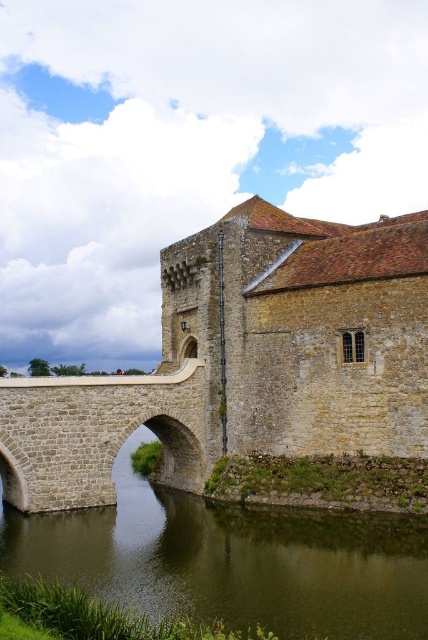
Question: Can you confirm if green stone water at center is smaller than stone bridge at center?

Choices:
 (A) yes
 (B) no

Answer: (B)

Question: Considering the real-world distances, which object is closest to the green stone water at center?

Choices:
 (A) stone bridge at center
 (B) stone brick castle at center

Answer: (A)

Question: Is stone brick castle at center wider than stone bridge at center?

Choices:
 (A) yes
 (B) no

Answer: (A)

Question: Which of the following is the farthest from the observer?

Choices:
 (A) (374, 584)
 (B) (300, 442)

Answer: (B)

Question: Which of the following is the farthest from the observer?

Choices:
 (A) (366, 608)
 (B) (115, 380)
 (C) (273, 356)

Answer: (C)

Question: Can you confirm if green stone water at center is thinner than stone bridge at center?

Choices:
 (A) yes
 (B) no

Answer: (B)